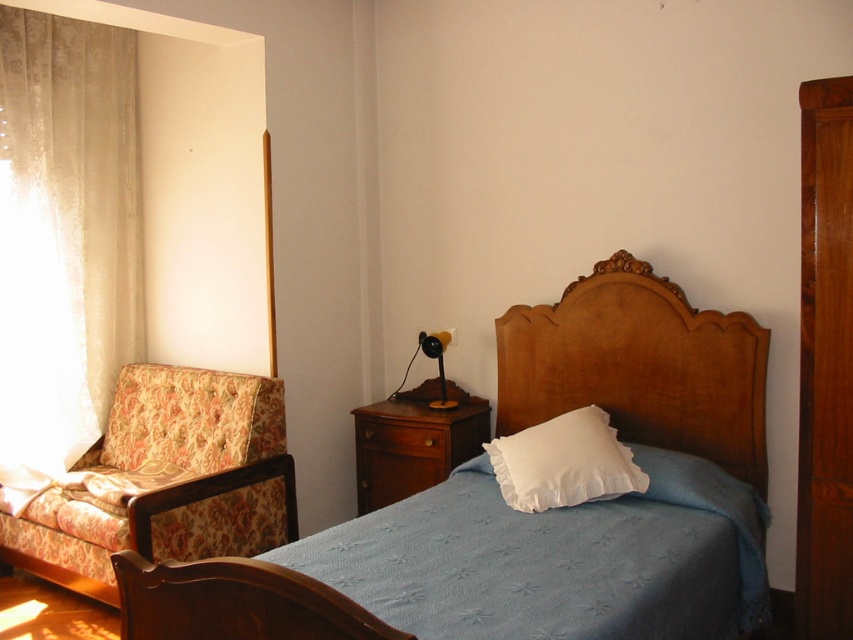
Between wooden dresser at center and white fluffy pillow at center, which one is positioned higher?

Positioned higher is wooden dresser at center.

Between wooden dresser at center and white fluffy pillow at center, which one has more height?

wooden dresser at center is taller.

Describe the element at coordinates (825, 364) in the screenshot. I see `wooden dresser at center` at that location.

The height and width of the screenshot is (640, 853). In order to click on wooden dresser at center in this screenshot , I will do `click(825, 364)`.

Can you confirm if wooden headboard at center is positioned to the left of brown wood drawer at lower center?

Incorrect, wooden headboard at center is not on the left side of brown wood drawer at lower center.

Between point (709, 340) and point (427, 432), which one is positioned behind?

The point (427, 432) is more distant.

Locate an element on the screen. wooden headboard at center is located at coordinates (639, 365).

You are a GUI agent. You are given a task and a screenshot of the screen. Output one action in this format:
    pyautogui.click(x=<x>, y=<y>)
    Task: Click on the wooden headboard at center
    This screenshot has width=853, height=640.
    Given the screenshot: What is the action you would take?
    pyautogui.click(x=639, y=365)

Can you confirm if wooden bed at center is smaller than wooden dresser at center?

No.

Does point (680, 298) come behind point (844, 340)?

Yes, point (680, 298) is behind point (844, 340).

You are a GUI agent. You are given a task and a screenshot of the screen. Output one action in this format:
    pyautogui.click(x=<x>, y=<y>)
    Task: Click on the wooden bed at center
    This screenshot has width=853, height=640.
    Given the screenshot: What is the action you would take?
    pyautogui.click(x=640, y=364)